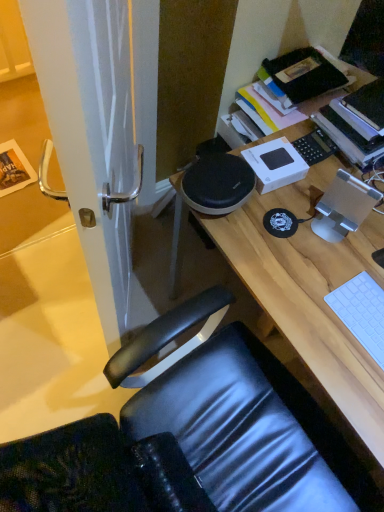
Question: Is white matte keyboard at lower right to the left of hardcover book at upper right from the viewer's perspective?

Choices:
 (A) no
 (B) yes

Answer: (B)

Question: Is hardcover book at upper right completely or partially inside white matte keyboard at lower right?

Choices:
 (A) yes
 (B) no

Answer: (B)

Question: Considering the relative sizes of white matte keyboard at lower right and hardcover book at upper right in the image provided, is white matte keyboard at lower right smaller than hardcover book at upper right?

Choices:
 (A) yes
 (B) no

Answer: (A)

Question: Is white matte keyboard at lower right placed right next to hardcover book at upper right?

Choices:
 (A) yes
 (B) no

Answer: (B)

Question: Does white matte keyboard at lower right have a lesser height compared to hardcover book at upper right?

Choices:
 (A) yes
 (B) no

Answer: (A)

Question: Considering the positions of point (380, 304) and point (64, 114), is point (380, 304) closer or farther from the camera than point (64, 114)?

Choices:
 (A) farther
 (B) closer

Answer: (A)

Question: From a real-world perspective, is white matte keyboard at lower right positioned above or below white glossy door handle at left?

Choices:
 (A) above
 (B) below

Answer: (A)

Question: From the image's perspective, is white matte keyboard at lower right positioned above or below white glossy door handle at left?

Choices:
 (A) below
 (B) above

Answer: (A)

Question: Considering their positions, is white matte keyboard at lower right located in front of or behind white glossy door handle at left?

Choices:
 (A) behind
 (B) front

Answer: (A)

Question: From a real-world perspective, is hardcover book at upper right physically located above or below wooden desk at center?

Choices:
 (A) above
 (B) below

Answer: (A)

Question: Relative to wooden desk at center, is hardcover book at upper right in front or behind?

Choices:
 (A) front
 (B) behind

Answer: (B)

Question: Is point (340, 98) closer or farther from the camera than point (367, 435)?

Choices:
 (A) closer
 (B) farther

Answer: (B)

Question: Choose the correct answer: Is hardcover book at upper right inside wooden desk at center or outside it?

Choices:
 (A) inside
 (B) outside

Answer: (B)

Question: Based on their positions, is hardcover book at upper right located to the left or right of white matte keyboard at lower right?

Choices:
 (A) right
 (B) left

Answer: (A)

Question: Is point (379, 153) closer or farther from the camera than point (327, 302)?

Choices:
 (A) closer
 (B) farther

Answer: (B)